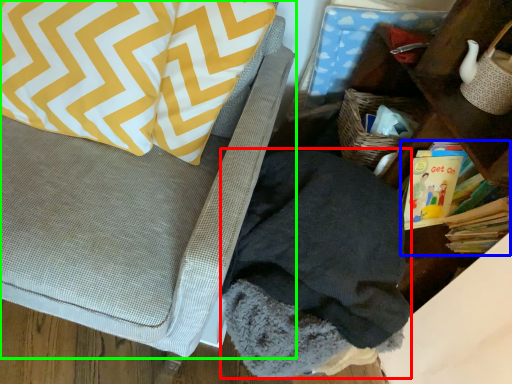
Question: Which object is positioned closest to clothing (highlighted by a red box)? Select from book (highlighted by a blue box) and furniture (highlighted by a green box).

Choices:
 (A) book
 (B) furniture

Answer: (B)